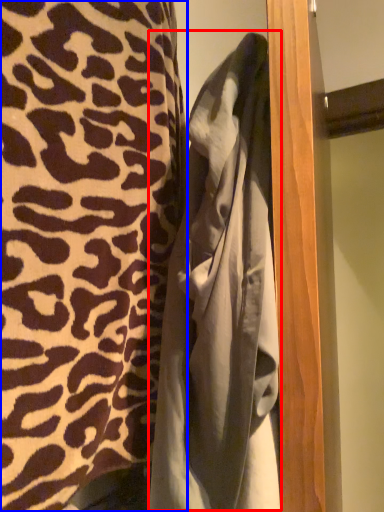
Question: Which of the following is the farthest to the observer, bathrobe (highlighted by a red box) or curtain (highlighted by a blue box)?

Choices:
 (A) bathrobe
 (B) curtain

Answer: (A)